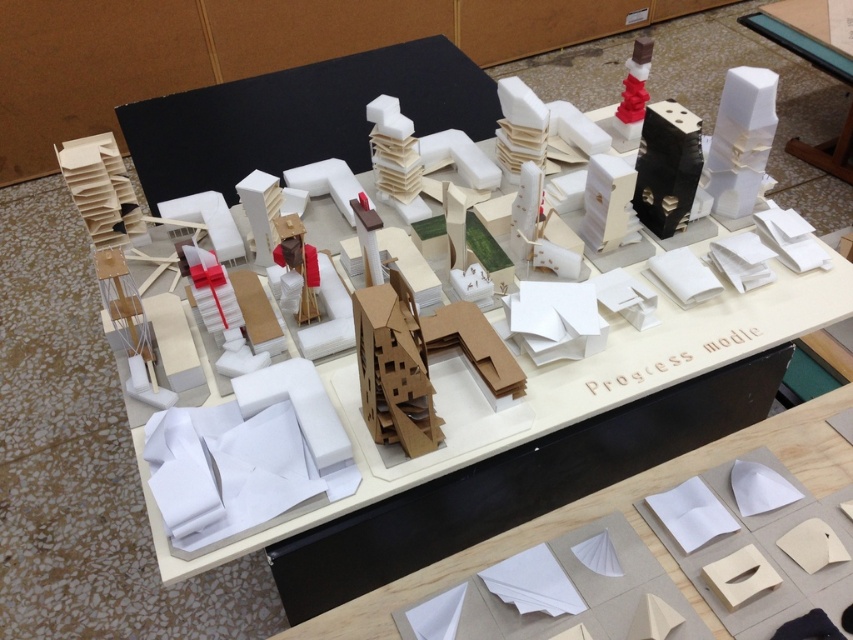
You are an architect examining the architectural model. You notice the white paper at center and the white cardboard table at center. Which object is positioned lower in the model?

The white paper at center is positioned below the white cardboard table at center, so it is lower in the model.

You are a city planner reviewing the architectural model. You need to place a new red marker at the exact center of the white paper at center. Where should you place it?

The exact center of the white paper at center is located at the point specified in its 2D coordinates, which is at point (610, 512). Therefore, you should place the new red marker at point (610, 512).

You are an architect examining the architectural model. You notice the white paper at center and the white cardboard table at center. Which object is taller in the model?

The white cardboard table at center is taller than the white paper at center.